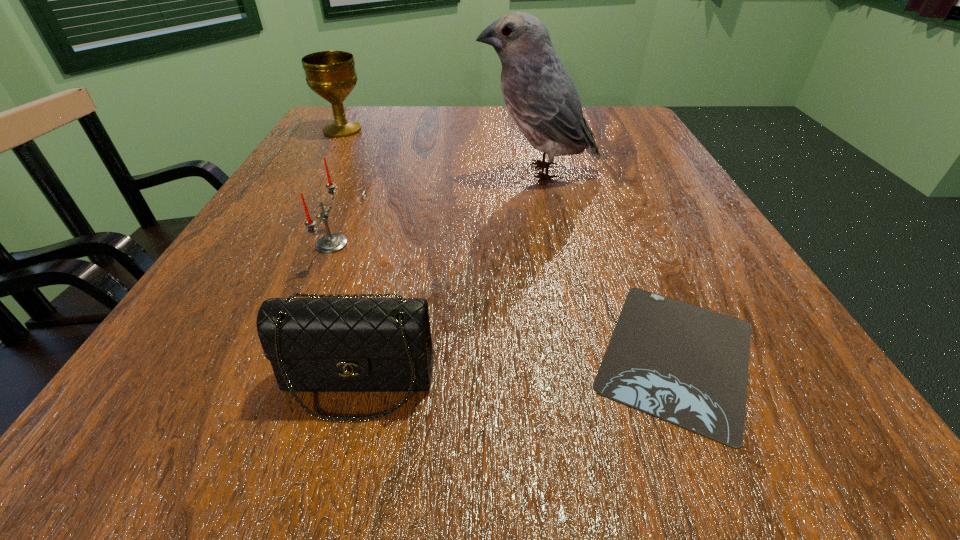
Find the location of a particular element. The height and width of the screenshot is (540, 960). object that is at the far left corner is located at coordinates (331, 74).

Image resolution: width=960 pixels, height=540 pixels. In order to click on object that is at the near right corner in this screenshot , I will do `click(687, 365)`.

Where is `vacant region at the far edge of the desktop`? vacant region at the far edge of the desktop is located at coordinates (510, 117).

The image size is (960, 540). Identify the location of vacant space at the left edge. (259, 251).

Image resolution: width=960 pixels, height=540 pixels. Identify the location of free space at the right edge of the desktop. (658, 214).

At what (x,y) coordinates should I click in order to perform the action: click on vacant region at the far left corner. Please return your answer as a coordinate pair (x, y). Looking at the image, I should click on point(361,140).

Image resolution: width=960 pixels, height=540 pixels. In the image, there is a desktop. Identify the location of free space at the far right corner. click(593, 129).

The width and height of the screenshot is (960, 540). Identify the location of vacant area that lies between the clutch bag and the tallest object. [x=447, y=277].

Find the location of a particular element. vacant space that's between the third nearest object and the farthest object is located at coordinates (337, 187).

The image size is (960, 540). Identify the location of free space between the second farthest object and the candle. (435, 208).